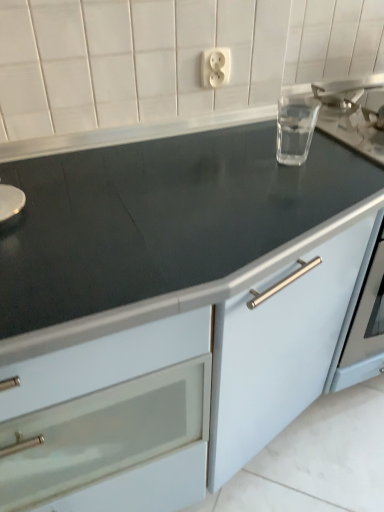
Question: From the image's perspective, is white plastic outlet at upper center under matte white cabinet at center?

Choices:
 (A) no
 (B) yes

Answer: (A)

Question: Is white plastic outlet at upper center taller than matte white cabinet at center?

Choices:
 (A) yes
 (B) no

Answer: (B)

Question: From a real-world perspective, is white plastic outlet at upper center positioned under matte white cabinet at center based on gravity?

Choices:
 (A) no
 (B) yes

Answer: (A)

Question: From the image's perspective, does white plastic outlet at upper center appear higher than matte white cabinet at center?

Choices:
 (A) yes
 (B) no

Answer: (A)

Question: Can you confirm if white plastic outlet at upper center is smaller than matte white cabinet at center?

Choices:
 (A) yes
 (B) no

Answer: (A)

Question: Does white plastic outlet at upper center come behind matte white cabinet at center?

Choices:
 (A) yes
 (B) no

Answer: (A)

Question: Does matte white cabinet at center have a greater width compared to transparent glass at upper right?

Choices:
 (A) yes
 (B) no

Answer: (A)

Question: Is matte white cabinet at center far from transparent glass at upper right?

Choices:
 (A) no
 (B) yes

Answer: (A)

Question: Can you confirm if matte white cabinet at center is taller than transparent glass at upper right?

Choices:
 (A) yes
 (B) no

Answer: (A)

Question: From the image's perspective, does matte white cabinet at center appear lower than transparent glass at upper right?

Choices:
 (A) no
 (B) yes

Answer: (B)

Question: From a real-world perspective, is matte white cabinet at center below transparent glass at upper right?

Choices:
 (A) yes
 (B) no

Answer: (A)

Question: Does matte white cabinet at center appear on the right side of transparent glass at upper right?

Choices:
 (A) yes
 (B) no

Answer: (B)

Question: Is white plastic outlet at upper center at the right side of transparent glass at upper right?

Choices:
 (A) no
 (B) yes

Answer: (A)